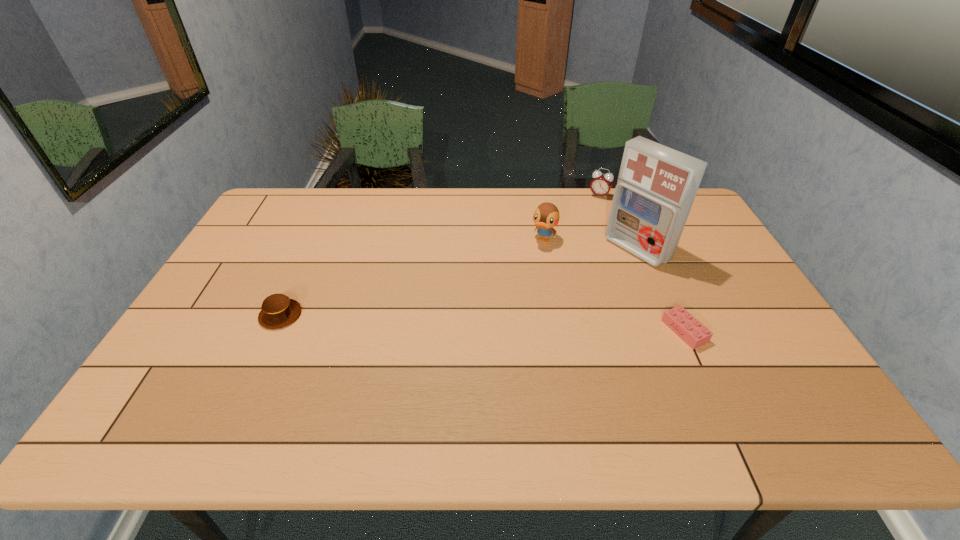
The image size is (960, 540). What are the coordinates of `free space between the muffin and the alarm clock` in the screenshot? It's located at (440, 255).

At what (x,y) coordinates should I click in order to perform the action: click on vacant space that is in between the farthest object and the muffin. Please return your answer as a coordinate pair (x, y). The height and width of the screenshot is (540, 960). Looking at the image, I should click on (440, 255).

The width and height of the screenshot is (960, 540). I want to click on free spot between the duck and the tallest object, so click(x=590, y=245).

Select which object is the closest to the second object from left to right. Please provide its 2D coordinates. Your answer should be formatted as a tuple, i.e. [(x, y)], where the tuple contains the x and y coordinates of a point satisfying the conditions above.

[(656, 187)]

Select which object appears as the closest to the fourth shortest object. Please provide its 2D coordinates. Your answer should be formatted as a tuple, i.e. [(x, y)], where the tuple contains the x and y coordinates of a point satisfying the conditions above.

[(656, 187)]

Locate an element on the screen. This screenshot has width=960, height=540. free space that satisfies the following two spatial constraints: 1. on the front side of the Lego; 2. on the right side of the duck is located at coordinates (560, 331).

Identify the location of free spot that satisfies the following two spatial constraints: 1. on the front side of the fourth tallest object; 2. on the left side of the shortest object. This screenshot has height=540, width=960. (274, 331).

Image resolution: width=960 pixels, height=540 pixels. Identify the location of vacant point that satisfies the following two spatial constraints: 1. on the back side of the farthest object; 2. on the right side of the duck. (536, 196).

Where is `vacant region that satisfies the following two spatial constraints: 1. on the front side of the Lego; 2. on the left side of the leftmost object`? vacant region that satisfies the following two spatial constraints: 1. on the front side of the Lego; 2. on the left side of the leftmost object is located at coordinates (274, 331).

This screenshot has width=960, height=540. Identify the location of free space that satisfies the following two spatial constraints: 1. on the back side of the muffin; 2. on the left side of the third tallest object. (335, 196).